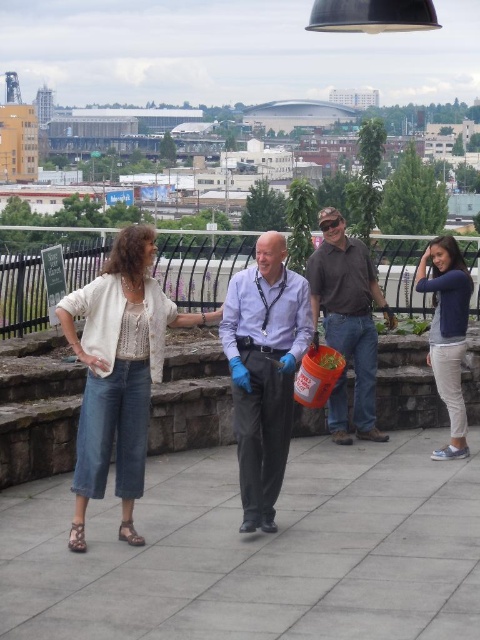
Who is shorter, denim pants at center or brown cotton shirt at center?

With less height is denim pants at center.

Who is more forward, (144, 420) or (350, 333)?

Positioned in front is point (144, 420).

Where is `denim pants at center`? Image resolution: width=480 pixels, height=640 pixels. denim pants at center is located at coordinates (119, 372).

Can you confirm if denim pants at center is bigger than matte blue shirt at center?

Yes.

Does denim pants at center lie in front of matte blue shirt at center?

Yes, denim pants at center is closer to the viewer.

Is point (124, 273) farther from viewer compared to point (276, 436)?

Yes, point (124, 273) is farther from viewer.

I want to click on denim pants at center, so click(x=119, y=372).

At what (x,y) coordinates should I click in order to perform the action: click on matte blue shirt at center. Please return your answer as a coordinate pair (x, y). This screenshot has height=640, width=480. Looking at the image, I should click on (264, 371).